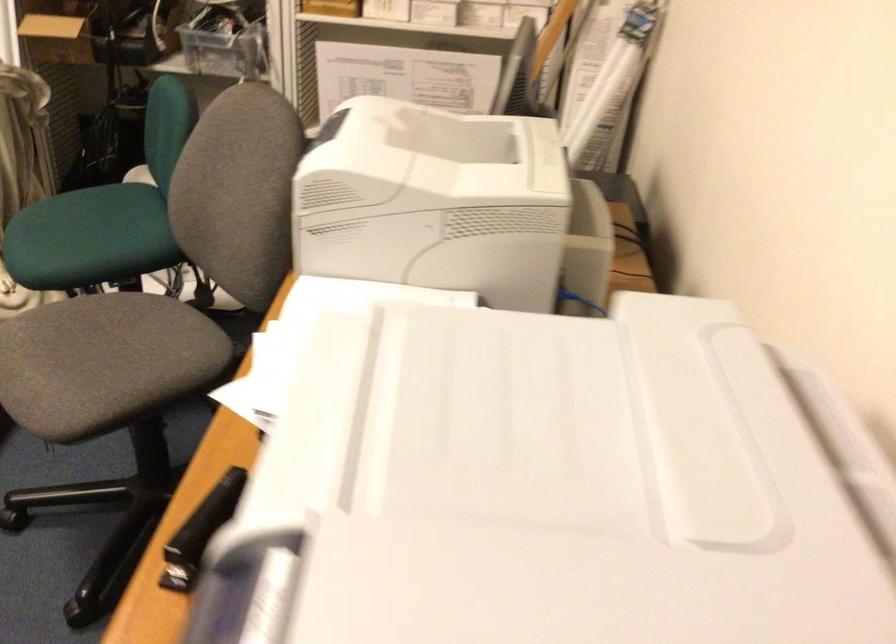
The height and width of the screenshot is (644, 896). I want to click on green chair sitting surface, so click(x=90, y=238).